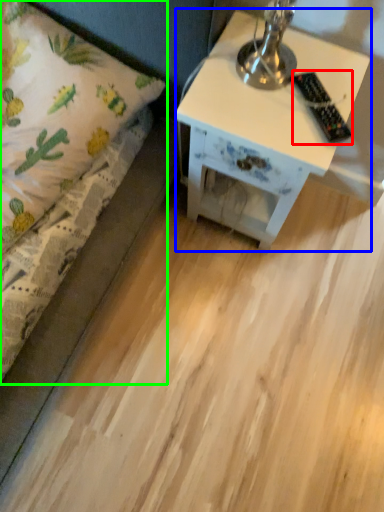
Question: Estimate the real-world distances between objects in this image. Which object is closer to remote control (highlighted by a red box), nightstand (highlighted by a blue box) or bed (highlighted by a green box)?

Choices:
 (A) nightstand
 (B) bed

Answer: (A)